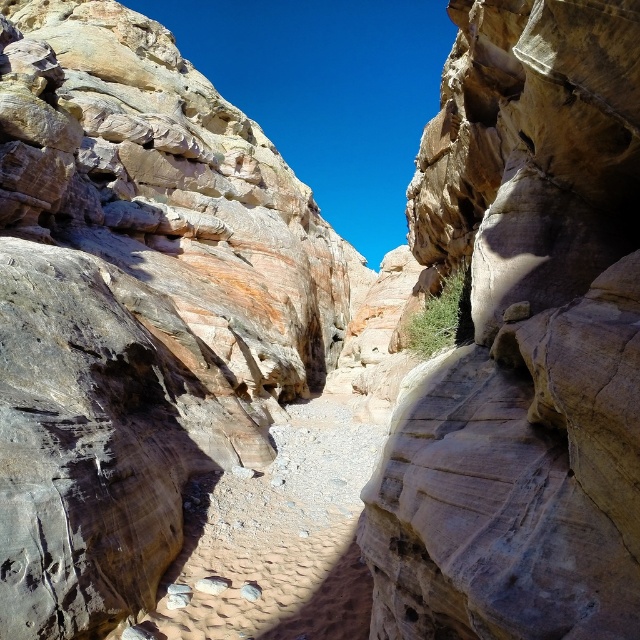
You are a hiker planning to cross the canyon floor between the rustic sandstone rock face at center and the smooth sandstone rock face at center. The path between them is 2 meters wide. If your backpack is 1.8 meters wide, can you safely pass through without touching either rock face?

The rustic sandstone rock face at center is wider than the smooth sandstone rock face at center. However, the path between them is 2 meters wide, which is wider than your backpack of 1.8 meters. Therefore, you can safely pass through without touching either rock face.